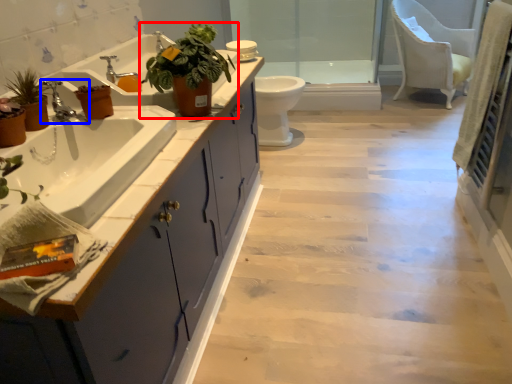
Question: Among these objects, which one is nearest to the camera, houseplant (highlighted by a red box) or tap (highlighted by a blue box)?

Choices:
 (A) houseplant
 (B) tap

Answer: (B)